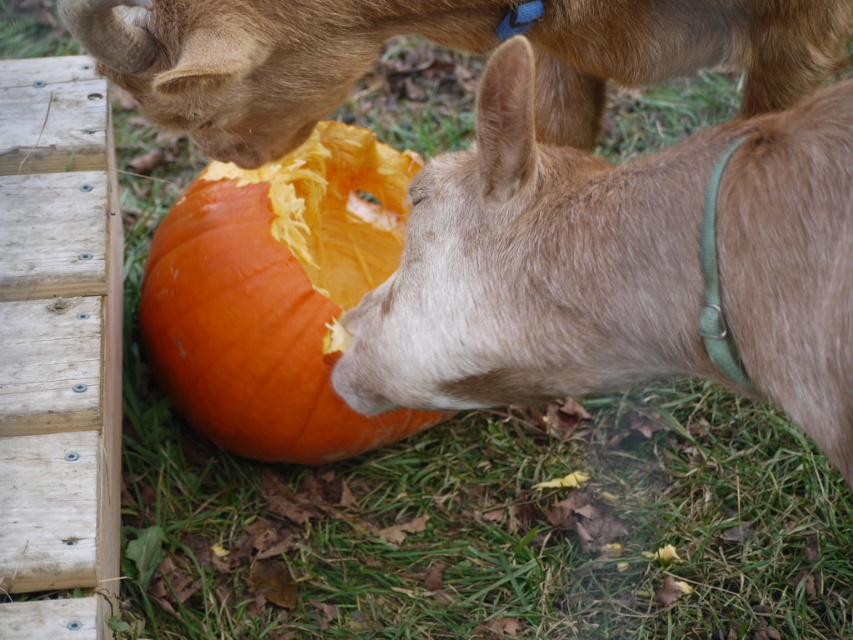
You are a farmer checking on your goats in the autumn garden. You notice the brown fuzzy goat at lower right and the brown fur goat at upper center near the carved pumpkin. Which goat is taller?

The brown fuzzy goat at lower right is much taller than the brown fur goat at upper center.

You are a farmer checking the pumpkin patch. You see the brown fur goat at upper center and the orange matte pumpkin at center. Which object is wider?

The brown fur goat at upper center might be wider than orange matte pumpkin at center.

You are standing 1.5 meters away from the carved pumpkin in the center. There is a point at coordinates point (461,216) that you want to reach. Can you safely walk to that point without moving closer than 1.3 meters to the carved pumpkin?

The distance of point (461,216) from viewer is 1.37 meters. Since you are currently 1.5 meters away from the carved pumpkin, moving to that point would bring you closer to the pumpkin by 0.13 meters, resulting in a distance of 1.37 meters. This meets the requirement of not moving closer than 1.3 meters, so it is safe to proceed.